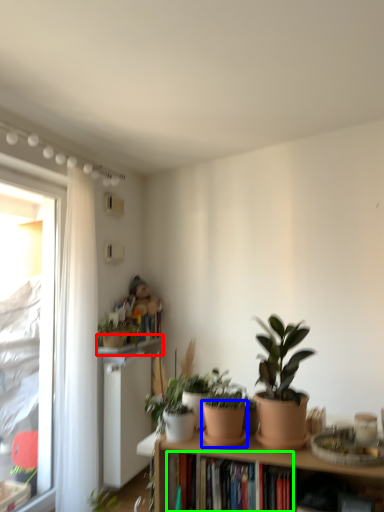
Question: Which object is positioned closest to window sill (highlighted by a red box)? Select from flowerpot (highlighted by a blue box) and book (highlighted by a green box).

Choices:
 (A) flowerpot
 (B) book

Answer: (B)